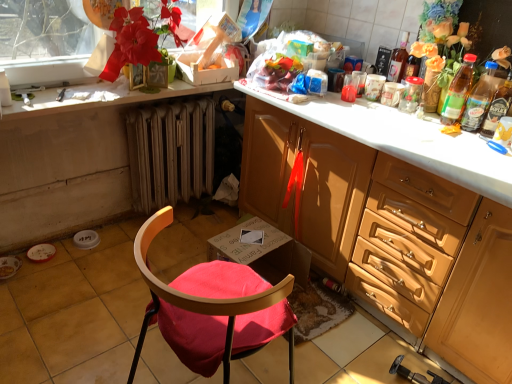
Question: Does point (472, 77) appear closer or farther from the camera than point (133, 114)?

Choices:
 (A) farther
 (B) closer

Answer: (B)

Question: Looking at their shapes, would you say translucent plastic bottle at upper right, which ranks as the 2th bottle in left-to-right order, is wider or thinner than metallic radiator at lower center?

Choices:
 (A) wide
 (B) thin

Answer: (B)

Question: Estimate the real-world distances between objects in this image. Which object is closer to the matte red flower at upper left?

Choices:
 (A) white glossy countertop at upper left
 (B) wooden cabinet at right
 (C) velvet red chair at lower left
 (D) transparent plastic window screen at upper left
 (E) translucent glass bottle at upper right, acting as the 1th bottle starting from the left

Answer: (A)

Question: Which of these objects is positioned farthest from the matte red flower at upper left?

Choices:
 (A) translucent plastic bottle at right, acting as the fourth bottle starting from the left
 (B) transparent plastic window screen at upper left
 (C) translucent plastic bottle at right, which is the 3th bottle from left to right
 (D) translucent plastic bottle at upper right, which appears as the third bottle when viewed from the right
 (E) metallic radiator at lower center

Answer: (A)